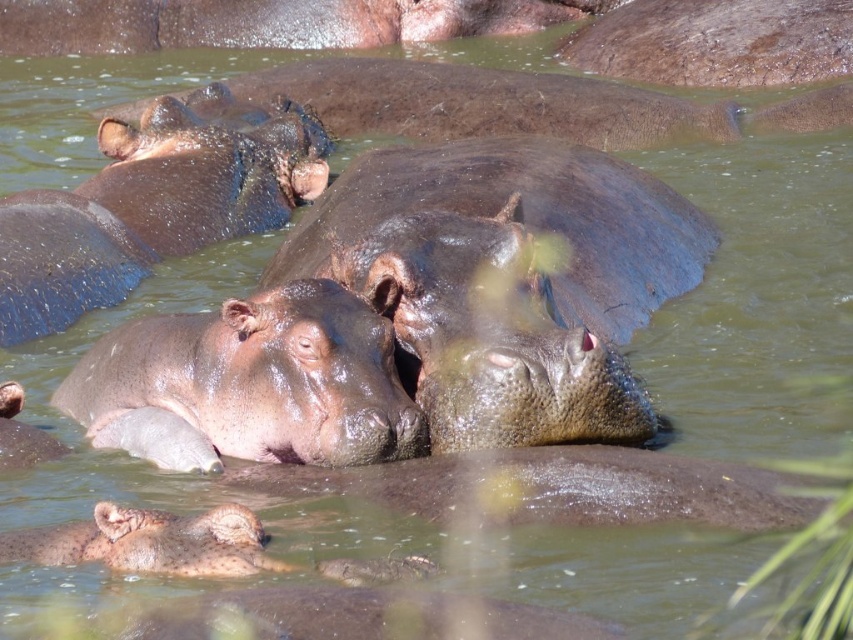
Consider the image. You are a wildlife photographer aiming to capture a photo of both the slick brown hippo at center and the smooth gray hippo at lower center. Based on their positions, which hippo is positioned to the right of the other?

The slick brown hippo at center is positioned to the right of the smooth gray hippo at lower center.